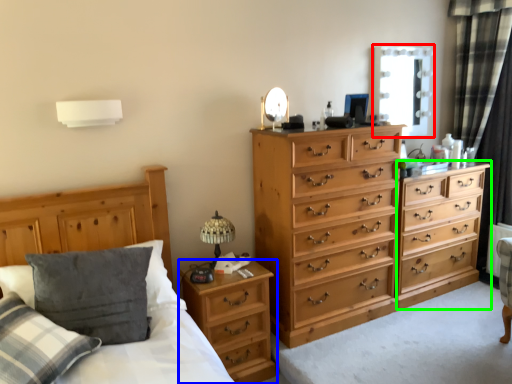
Question: Based on their relative distances, which object is farther from window screen (highlighted by a red box)? Choose from nightstand (highlighted by a blue box) and chest of drawers (highlighted by a green box).

Choices:
 (A) nightstand
 (B) chest of drawers

Answer: (A)